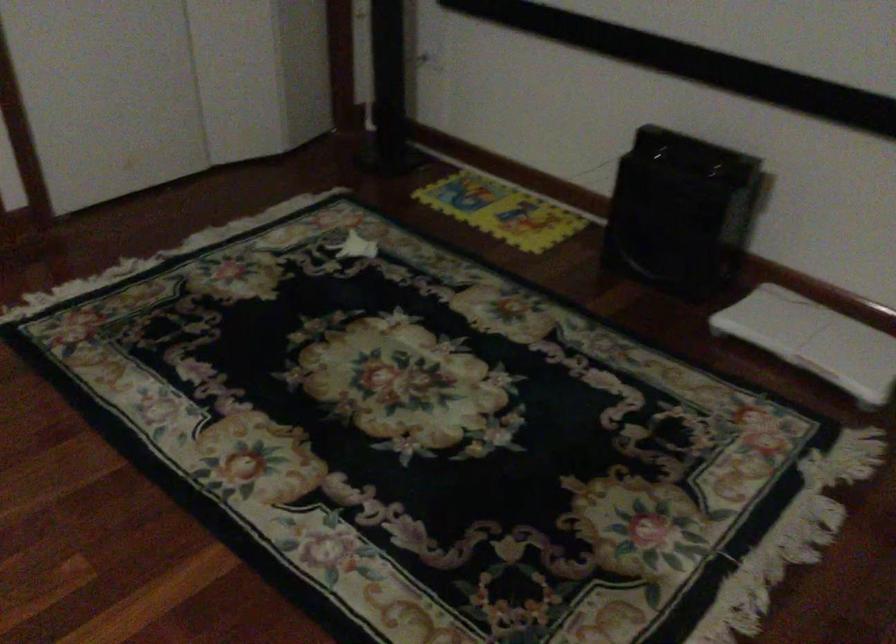
The location [681,212] corresponds to which object?

This point indicates the black space heater.